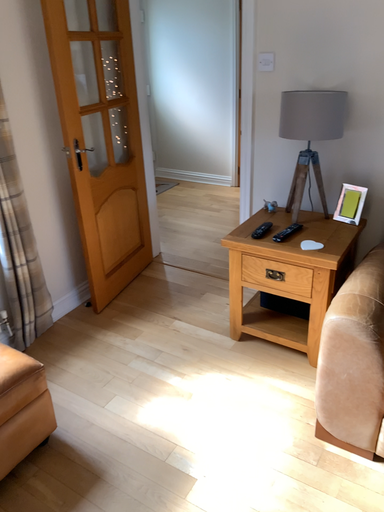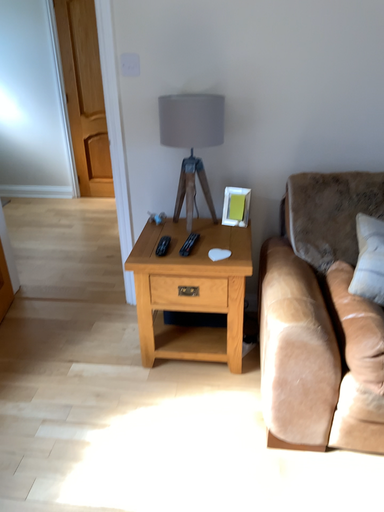
Question: Which way did the camera rotate in the video?

Choices:
 (A) rotated right
 (B) rotated left

Answer: (A)